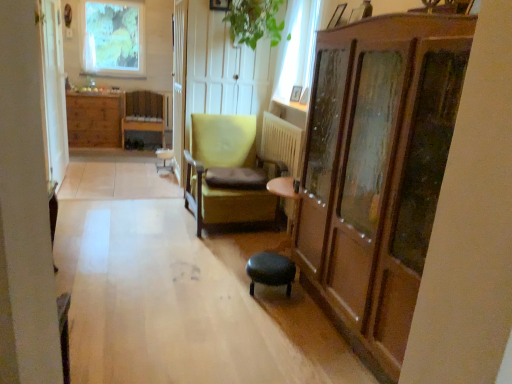
Where is `free space to the back side of white wood screen door at left, acting as the first screen door starting from the left`? The width and height of the screenshot is (512, 384). free space to the back side of white wood screen door at left, acting as the first screen door starting from the left is located at coordinates (90, 175).